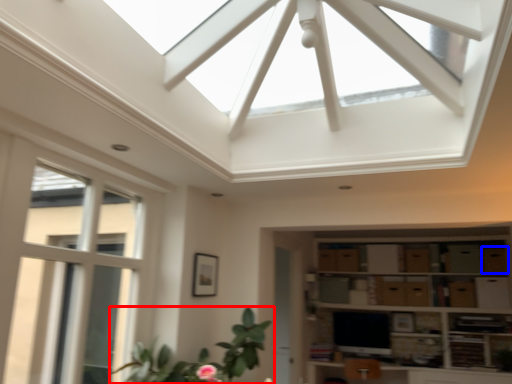
Question: Which of the following is the farthest to the observer, houseplant (highlighted by a red box) or drawer (highlighted by a blue box)?

Choices:
 (A) houseplant
 (B) drawer

Answer: (B)